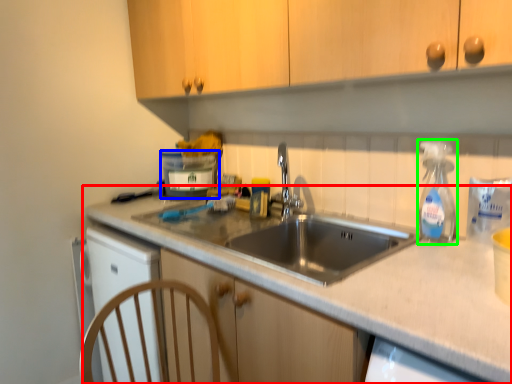
Question: Based on their relative distances, which object is nearer to countertop (highlighted by a red box)? Choose from appliance (highlighted by a blue box) and soap dispenser (highlighted by a green box).

Choices:
 (A) appliance
 (B) soap dispenser

Answer: (B)